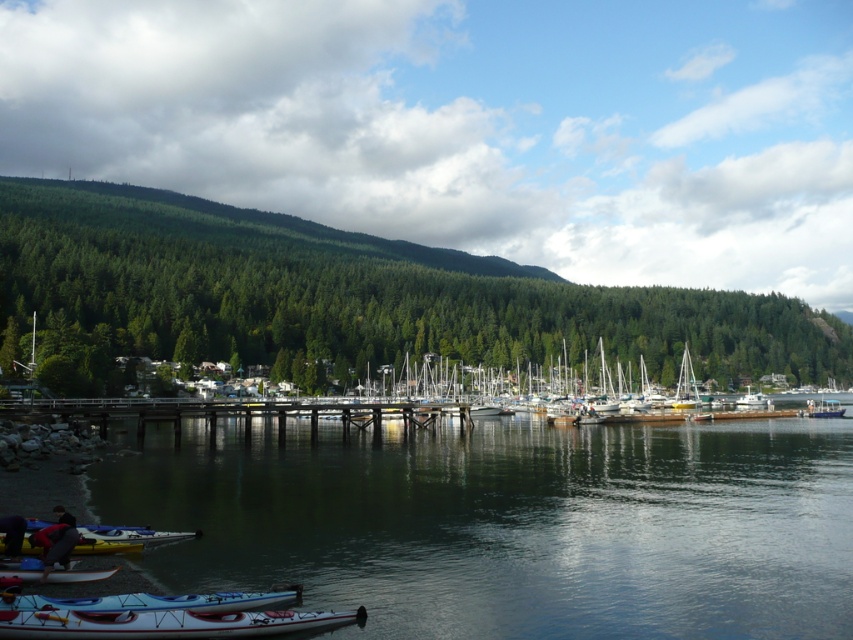
Can you confirm if yellow kayak at lower left is bigger than white plastic canoe at lower left?

No, yellow kayak at lower left is not bigger than white plastic canoe at lower left.

Between yellow kayak at lower left and white plastic canoe at lower left, which one appears on the right side from the viewer's perspective?

white plastic canoe at lower left is more to the right.

The height and width of the screenshot is (640, 853). I want to click on yellow kayak at lower left, so click(125, 538).

Can you confirm if green matte forest at upper left is wider than white glossy canoe at lower center?

Indeed, green matte forest at upper left has a greater width compared to white glossy canoe at lower center.

Can you confirm if green matte forest at upper left is positioned to the right of white glossy canoe at lower center?

Yes, green matte forest at upper left is to the right of white glossy canoe at lower center.

Does point (103, 211) lie behind point (15, 611)?

Yes, it is behind point (15, 611).

Image resolution: width=853 pixels, height=640 pixels. I want to click on green matte forest at upper left, so click(344, 296).

Is yellow kayak at lower left wider than white plastic boat at center?

Incorrect, yellow kayak at lower left's width does not surpass white plastic boat at center's.

Can you confirm if yellow kayak at lower left is bigger than white plastic boat at center?

Incorrect, yellow kayak at lower left is not larger than white plastic boat at center.

Is point (151, 531) positioned in front of point (840, 410)?

That is True.

The height and width of the screenshot is (640, 853). What are the coordinates of `yellow kayak at lower left` in the screenshot? It's located at (125, 538).